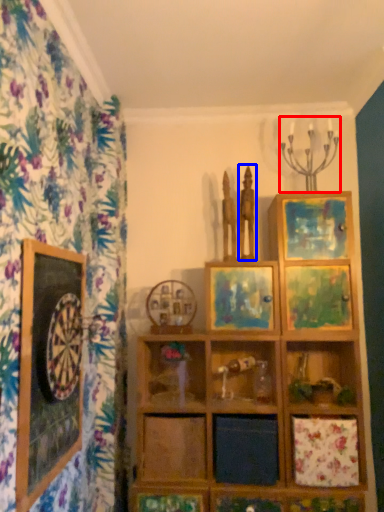
Question: Which object appears farthest to the camera in this image, candle holder (highlighted by a red box) or sculpture (highlighted by a blue box)?

Choices:
 (A) candle holder
 (B) sculpture

Answer: (B)